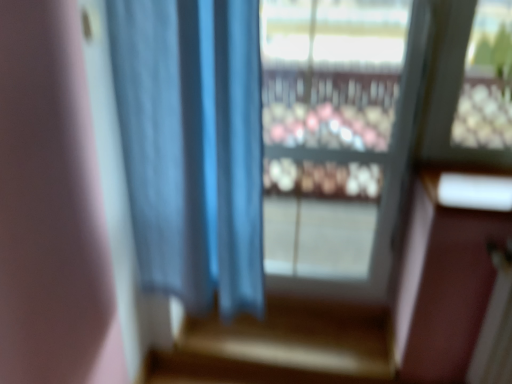
Question: Can you confirm if blue fabric curtain at center is smaller than transparent glass window at center?

Choices:
 (A) yes
 (B) no

Answer: (B)

Question: From the image's perspective, is blue fabric curtain at center under transparent glass window at center?

Choices:
 (A) no
 (B) yes

Answer: (B)

Question: Is blue fabric curtain at center aimed at transparent glass window at center?

Choices:
 (A) no
 (B) yes

Answer: (A)

Question: Are blue fabric curtain at center and transparent glass window at center far apart?

Choices:
 (A) yes
 (B) no

Answer: (A)

Question: Considering the relative sizes of blue fabric curtain at center and transparent glass window at center in the image provided, is blue fabric curtain at center thinner than transparent glass window at center?

Choices:
 (A) yes
 (B) no

Answer: (B)

Question: Is blue fabric curtain at center closer to camera compared to transparent glass window at center?

Choices:
 (A) no
 (B) yes

Answer: (B)

Question: Considering the relative sizes of transparent glass window at center and blue fabric curtain at center in the image provided, is transparent glass window at center shorter than blue fabric curtain at center?

Choices:
 (A) yes
 (B) no

Answer: (B)

Question: Is the depth of transparent glass window at center greater than that of blue fabric curtain at center?

Choices:
 (A) no
 (B) yes

Answer: (B)

Question: From a real-world perspective, is transparent glass window at center physically below blue fabric curtain at center?

Choices:
 (A) yes
 (B) no

Answer: (A)

Question: Is transparent glass window at center smaller than blue fabric curtain at center?

Choices:
 (A) yes
 (B) no

Answer: (A)

Question: Is transparent glass window at center in front of blue fabric curtain at center?

Choices:
 (A) no
 (B) yes

Answer: (A)

Question: From the image's perspective, does transparent glass window at center appear higher than blue fabric curtain at center?

Choices:
 (A) yes
 (B) no

Answer: (A)

Question: In the image, is transparent glass window at center positioned in front of or behind blue fabric curtain at center?

Choices:
 (A) behind
 (B) front

Answer: (A)